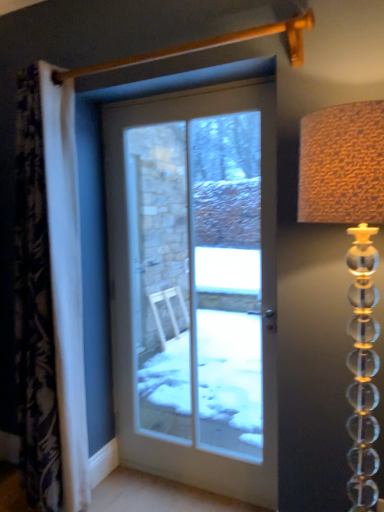
Question: From a real-world perspective, is white fabric curtain at left positioned above or below white glass door at center?

Choices:
 (A) below
 (B) above

Answer: (B)

Question: Is point (52, 373) positioned closer to the camera than point (253, 209)?

Choices:
 (A) closer
 (B) farther

Answer: (A)

Question: Estimate the real-world distances between objects in this image. Which object is farther from the translucent glass lampshade at right?

Choices:
 (A) white glass door at center
 (B) white fabric curtain at left

Answer: (A)

Question: Which object is the closest to the translucent glass lampshade at right?

Choices:
 (A) white fabric curtain at left
 (B) white glass door at center

Answer: (A)